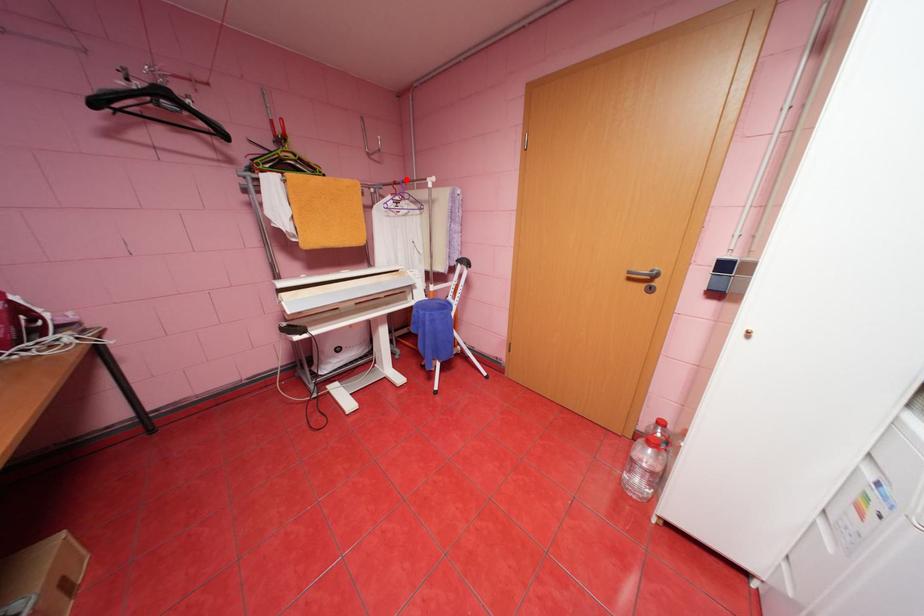
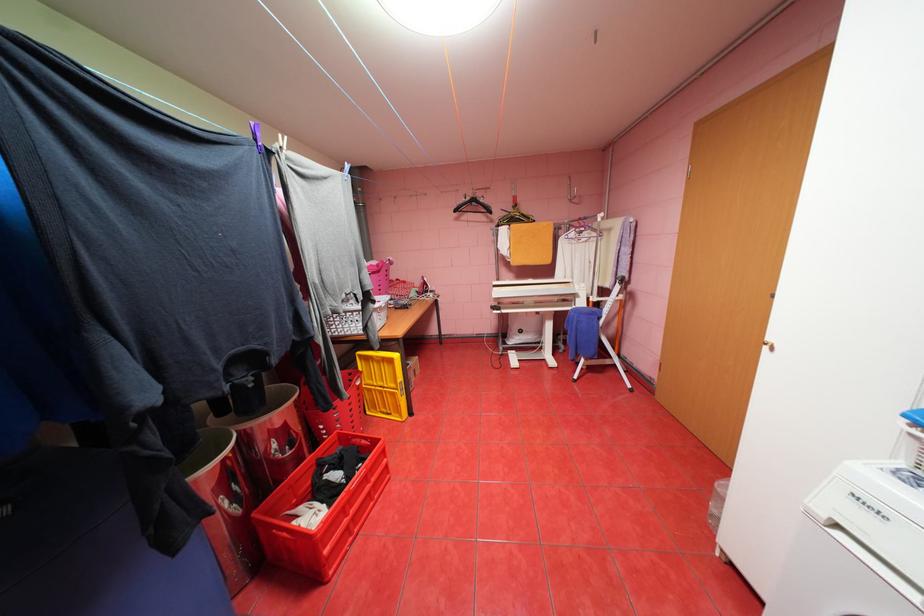
Where in the second image is the point corresponding to the highlighted location from the first image?

(591, 216)